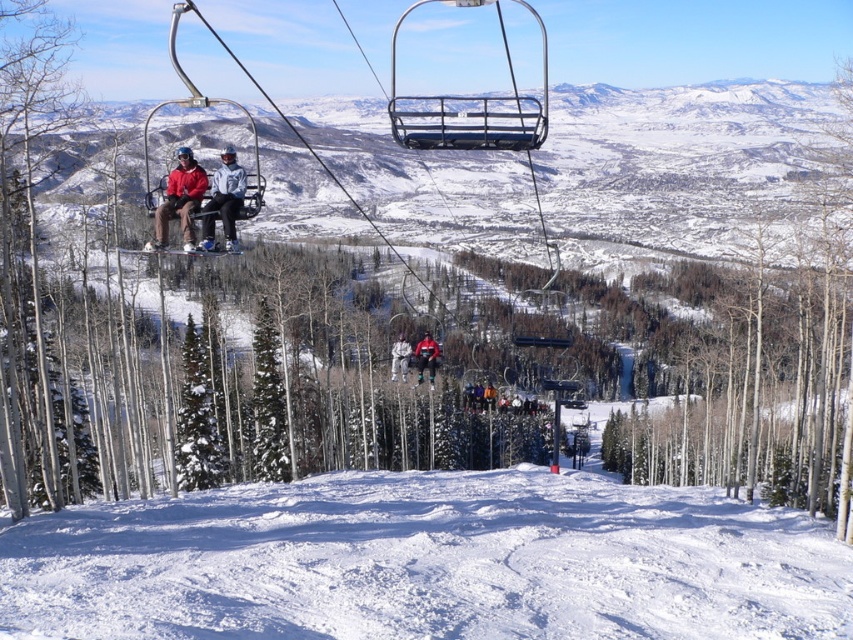
Can you confirm if metallic blue ski lift at upper center is wider than matte black jacket at center?

Correct, the width of metallic blue ski lift at upper center exceeds that of matte black jacket at center.

Can you confirm if metallic blue ski lift at upper center is positioned to the right of matte black jacket at center?

Correct, you'll find metallic blue ski lift at upper center to the right of matte black jacket at center.

Which is in front, point (480, 109) or point (201, 234)?

Point (201, 234) is in front.

The image size is (853, 640). Identify the location of metallic blue ski lift at upper center. click(x=469, y=106).

Does white powdery snow at lower center lie behind smooth white bark at center?

No, it is not.

Does white powdery snow at lower center appear over smooth white bark at center?

No.

Who is more forward, (292, 566) or (782, 483)?

Point (292, 566) is in front.

Find the location of a particular element. white powdery snow at lower center is located at coordinates (426, 563).

Is metallic blue ski lift at upper center behind red fabric jacket at center?

No, it is in front of red fabric jacket at center.

Does point (437, 115) come in front of point (437, 346)?

Yes, it is in front of point (437, 346).

Which is in front, point (544, 120) or point (428, 337)?

Point (544, 120) is more forward.

Where is `metallic blue ski lift at upper center`? This screenshot has width=853, height=640. metallic blue ski lift at upper center is located at coordinates (469, 106).